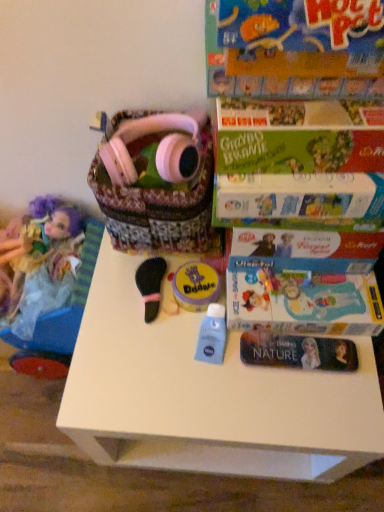
Find the location of a particular element. Image resolution: width=384 pixels, height=512 pixels. spots to the right of black felt brush at center, positioned as the second toy in right-to-left order is located at coordinates (218, 313).